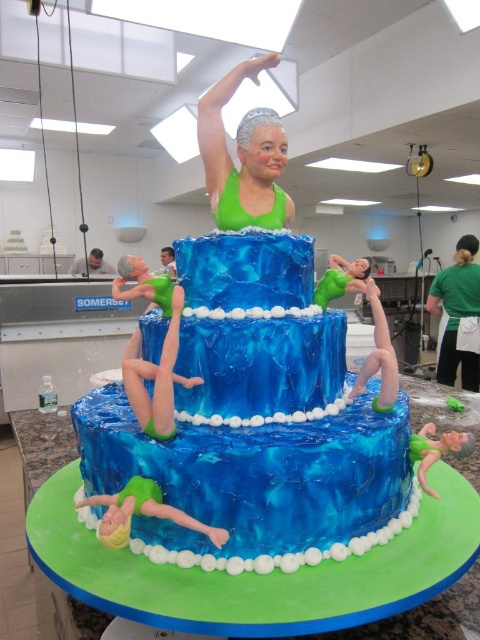
Question: Can you confirm if blue marbled cake at center is bigger than green fabric apron at lower right?

Choices:
 (A) no
 (B) yes

Answer: (A)

Question: In this image, where is blue marbled cake at center located relative to green fabric apron at lower right?

Choices:
 (A) left
 (B) right

Answer: (A)

Question: Is blue marbled cake at center closer to the viewer compared to green fabric apron at lower right?

Choices:
 (A) yes
 (B) no

Answer: (A)

Question: Which point is farther from the camera taking this photo?

Choices:
 (A) (468, 307)
 (B) (303, 467)

Answer: (A)